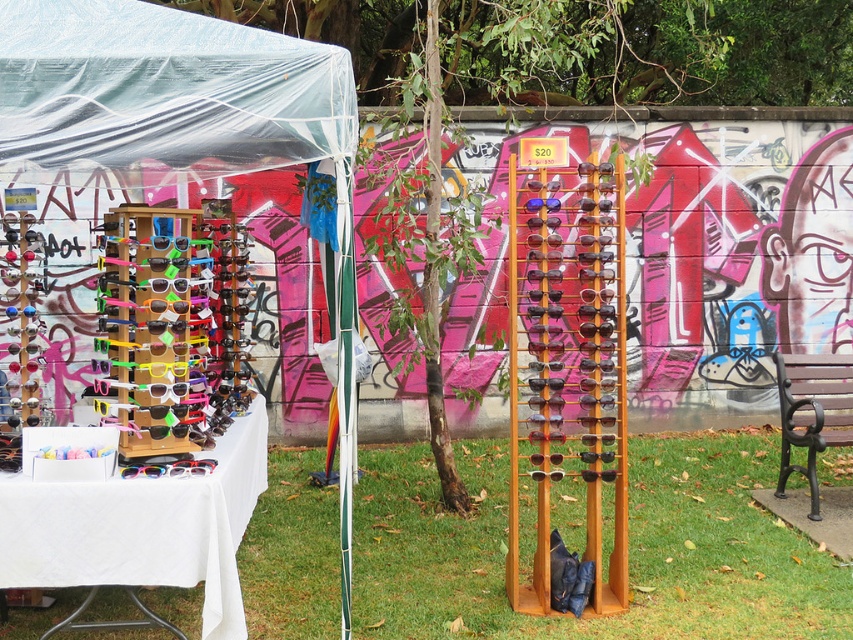
You are a customer at the outdoor market stall. You notice two points in the image, one at point coordinates point [340,230] and another at point [836,378]. Which point is closer to you?

Point [340,230] is closer to the camera than point [836,378], so the point at coordinates point [340,230] is closer to you.

You are a customer at the market stall and want to reach the sunglasses displayed on the wooden sunglasses stand at left and the white fabric table at left. Which one is taller?

The wooden sunglasses stand at left is taller than the white fabric table at left.

You are a customer at the market stall and want to know which object is larger between the wooden sunglasses stand at left and the white fabric table at left. Can you tell me?

The wooden sunglasses stand at left is bigger than the white fabric table at left.